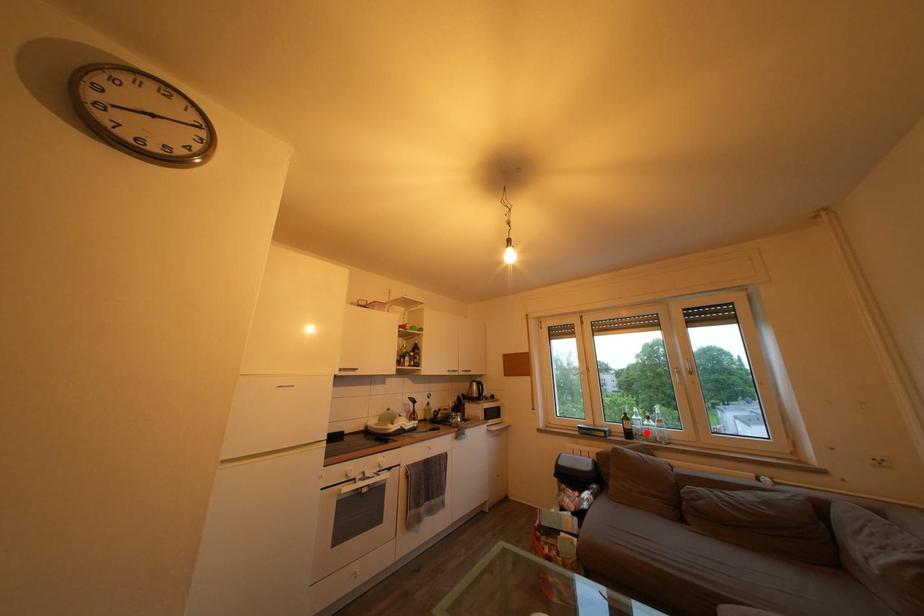
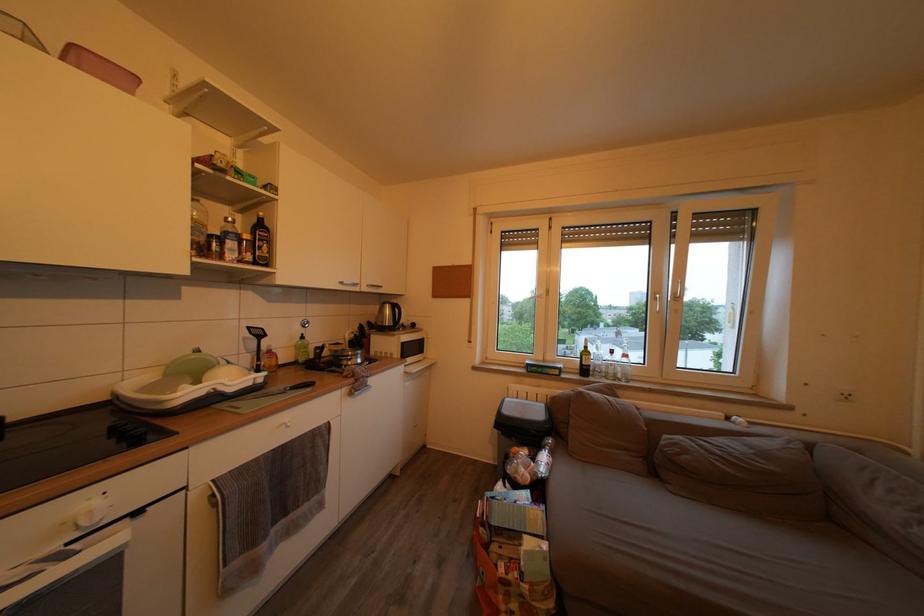
Question: I am providing you with two images of the same scene from different viewpoints. A red point is marked on the first image. At the location where the point appears in image 1, is it still visible in image 2?

Choices:
 (A) Yes
 (B) No

Answer: (A)